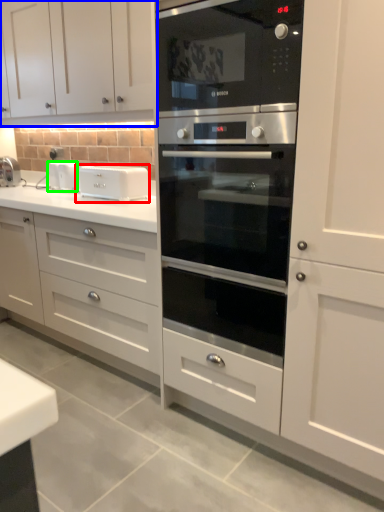
Question: Estimate the real-world distances between objects in this image. Which object is closer to appliance (highlighted by a red box), cabinetry (highlighted by a blue box) or appliance (highlighted by a green box)?

Choices:
 (A) cabinetry
 (B) appliance

Answer: (B)